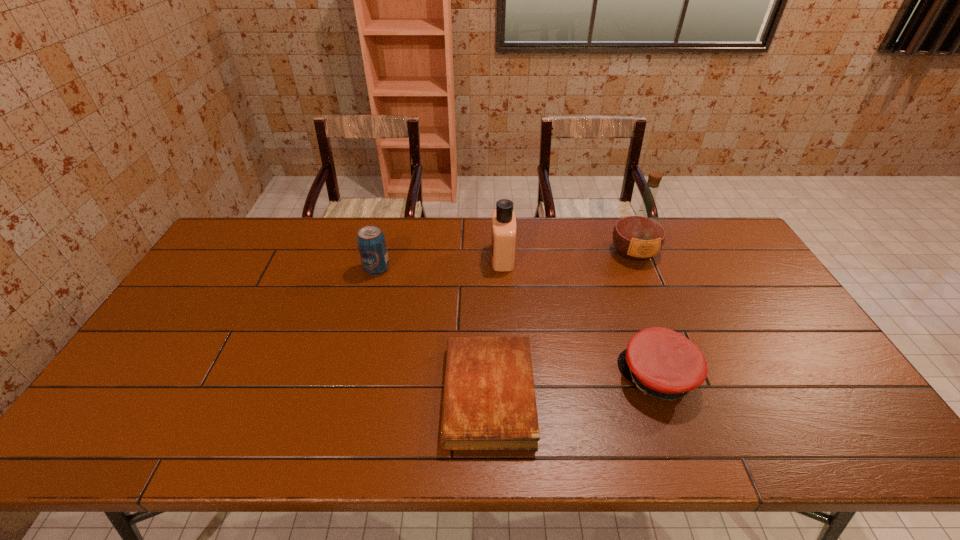
Where is `vacant space that's between the shortest object and the perfume`? The height and width of the screenshot is (540, 960). vacant space that's between the shortest object and the perfume is located at coordinates (495, 326).

This screenshot has width=960, height=540. Find the location of `free space between the cap and the perfume`. free space between the cap and the perfume is located at coordinates (580, 317).

You are a GUI agent. You are given a task and a screenshot of the screen. Output one action in this format:
    pyautogui.click(x=<x>, y=<y>)
    Task: Click on the free point between the pop soda and the fourth tallest object
    
    Given the screenshot: What is the action you would take?
    pyautogui.click(x=517, y=323)

The height and width of the screenshot is (540, 960). Find the location of `vacant area between the second tallest object and the cap`. vacant area between the second tallest object and the cap is located at coordinates (580, 317).

Identify which object is the second nearest to the perfume. Please provide its 2D coordinates. Your answer should be formatted as a tuple, i.e. [(x, y)], where the tuple contains the x and y coordinates of a point satisfying the conditions above.

[(639, 235)]

At what (x,y) coordinates should I click in order to perform the action: click on the third closest object to the liquor. Please return your answer as a coordinate pair (x, y). The width and height of the screenshot is (960, 540). Looking at the image, I should click on (489, 403).

The height and width of the screenshot is (540, 960). In order to click on vacant space that satisfies the following two spatial constraints: 1. on the front label of the tallest object; 2. on the front-facing side of the cap in this screenshot , I will do `click(686, 377)`.